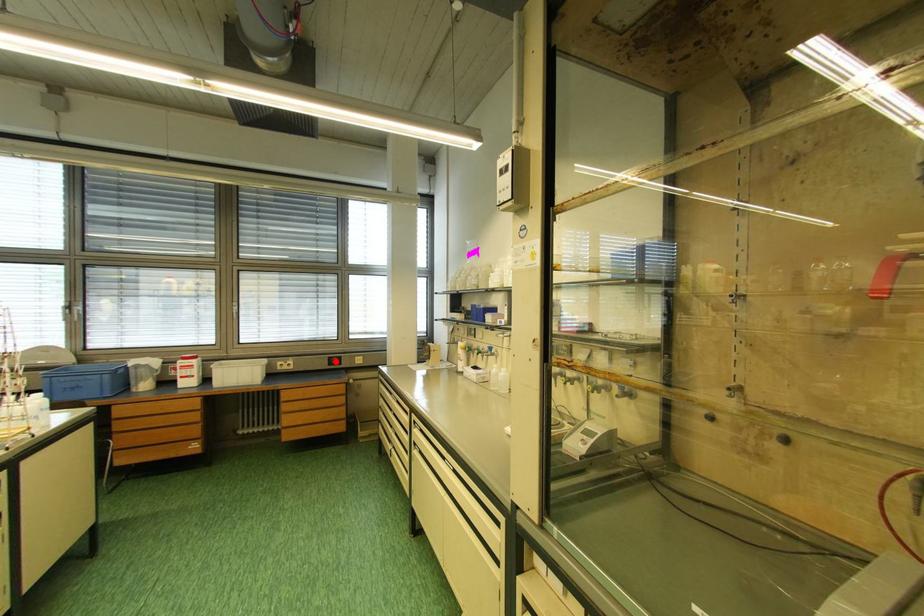
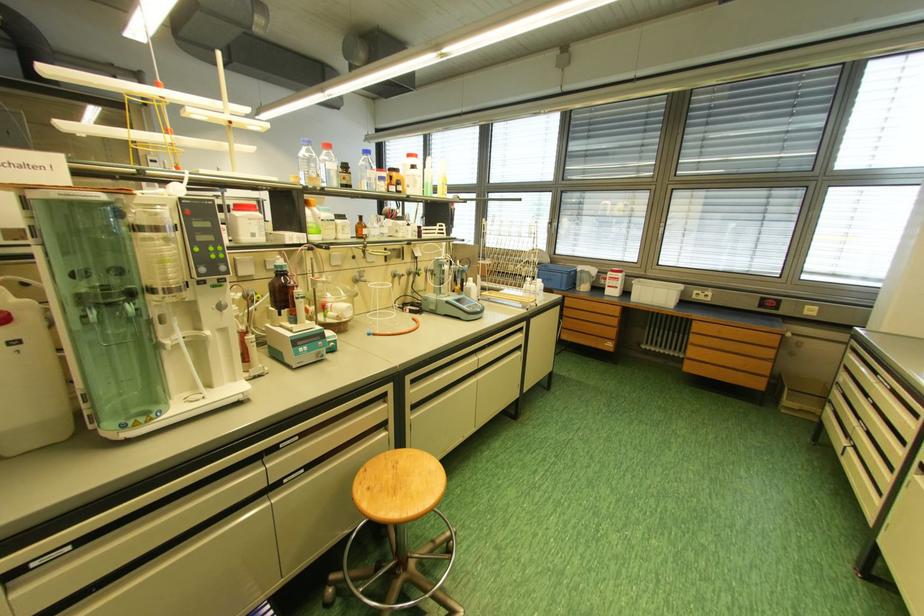
In the second image, find the point that corresponds to the highlighted location in the first image.

(769, 302)